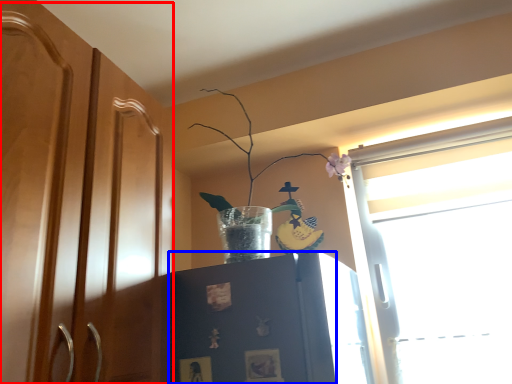
Question: Which object is further to the camera taking this photo, dresser (highlighted by a red box) or cabinetry (highlighted by a blue box)?

Choices:
 (A) dresser
 (B) cabinetry

Answer: (B)